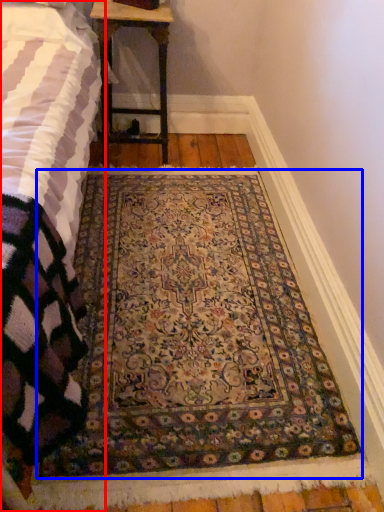
Question: Which point is further to the camera, bed (highlighted by a red box) or mat (highlighted by a blue box)?

Choices:
 (A) bed
 (B) mat

Answer: (B)